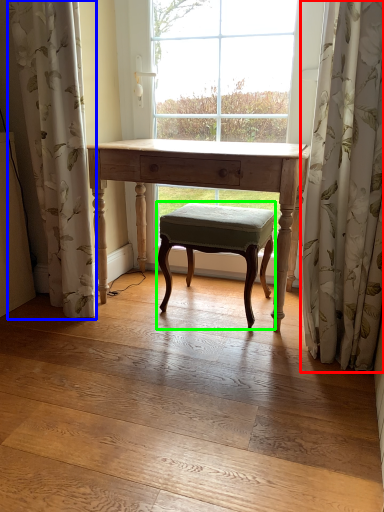
Question: Which object is positioned farthest from curtain (highlighted by a red box)? Select from curtain (highlighted by a blue box) and stool (highlighted by a green box).

Choices:
 (A) curtain
 (B) stool

Answer: (A)